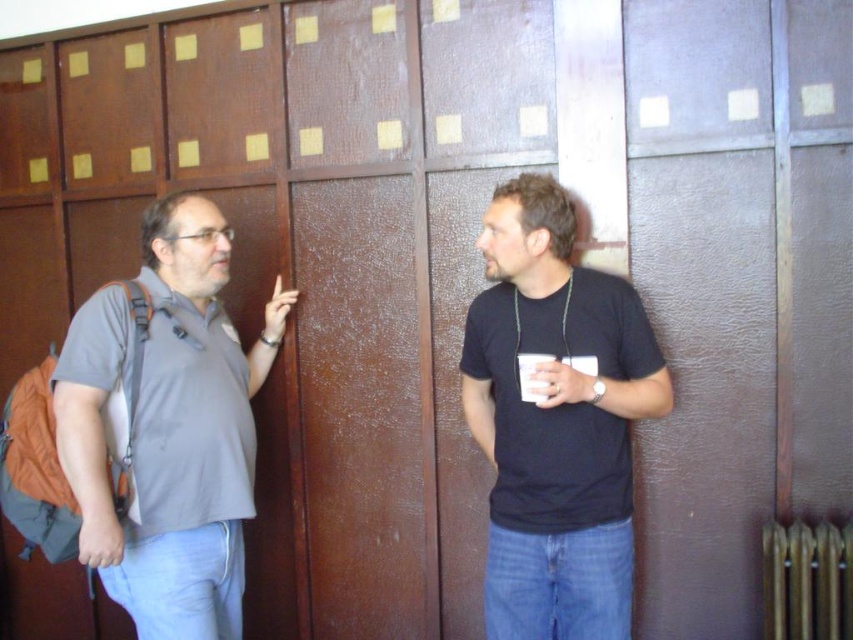
You are a visitor in this indoor space and need to locate the metallic gold radiator at lower right. From your current position facing the scene, which direction should you move to reach it first, considering the black matte shirt at right is blocking your view?

The black matte shirt at right is to the left of the metallic gold radiator at lower right, so to reach the radiator first, move to your right side past the black matte shirt at right.

You are standing in the storage room and need to locate the person wearing the black matte shirt at right. According to the coordinates given, where should you look to find them?

The black matte shirt at right is located at the coordinates point (555, 420), so you should look towards the lower right area of the image to find them.